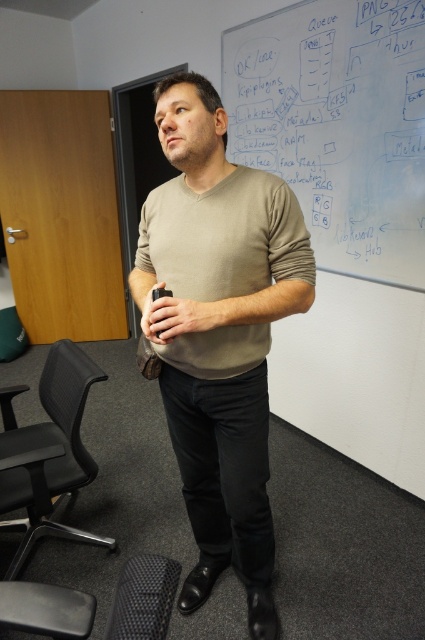
Is point (251, 205) closer to viewer compared to point (153, 289)?

No.

Is beige soft cotton shirt at center below matte black remote at center?

Actually, beige soft cotton shirt at center is above matte black remote at center.

Where is `beige soft cotton shirt at center`? The width and height of the screenshot is (425, 640). beige soft cotton shirt at center is located at coordinates (223, 236).

Does beige cotton sweater at center have a larger size compared to matte black cup at center?

Correct, beige cotton sweater at center is larger in size than matte black cup at center.

Is point (192, 276) positioned behind point (220, 324)?

Yes, point (192, 276) is behind point (220, 324).

Is point (161, 285) closer to viewer compared to point (155, 323)?

No, (161, 285) is behind (155, 323).

Image resolution: width=425 pixels, height=640 pixels. In order to click on beige cotton sweater at center in this screenshot , I will do `click(221, 333)`.

Is beige cotton sweater at center above beige soft cotton shirt at center?

No, beige cotton sweater at center is not above beige soft cotton shirt at center.

Can you confirm if beige cotton sweater at center is bigger than beige soft cotton shirt at center?

Correct, beige cotton sweater at center is larger in size than beige soft cotton shirt at center.

Identify the location of beige cotton sweater at center. The image size is (425, 640). (221, 333).